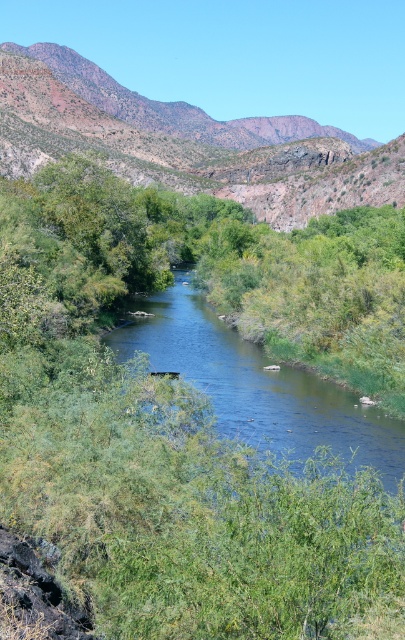
Between brown rocky mountain at upper center and clear water at center, which one has less height?

clear water at center is shorter.

Between brown rocky mountain at upper center and clear water at center, which one has more height?

Answer: With more height is brown rocky mountain at upper center.

Between point (338, 154) and point (147, 316), which one is positioned behind?

Positioned behind is point (338, 154).

Find the location of a particular element. The width and height of the screenshot is (405, 640). brown rocky mountain at upper center is located at coordinates (189, 152).